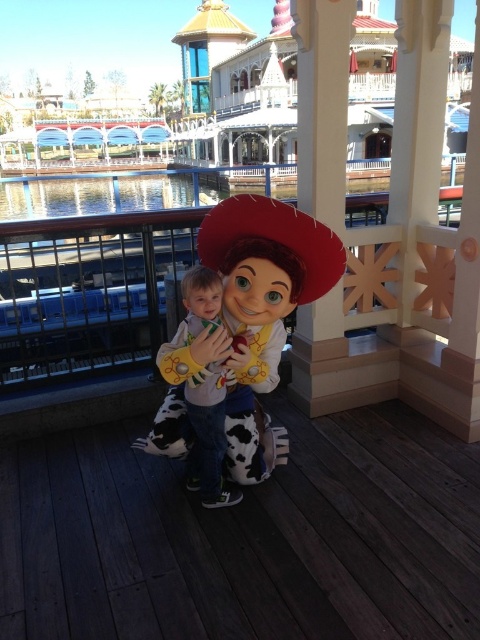
Question: Which object appears closest to the camera in this image?

Choices:
 (A) wooden deck at center
 (B) cowboy hat at center

Answer: (A)

Question: Which of the following is the farthest from the observer?

Choices:
 (A) wooden deck at center
 (B) cowboy hat at center

Answer: (B)

Question: Can you confirm if wooden deck at center is positioned to the left of cowboy hat at center?

Choices:
 (A) no
 (B) yes

Answer: (B)

Question: Is wooden deck at center above cowboy hat at center?

Choices:
 (A) no
 (B) yes

Answer: (A)

Question: Can you confirm if wooden deck at center is positioned above cowboy hat at center?

Choices:
 (A) no
 (B) yes

Answer: (A)